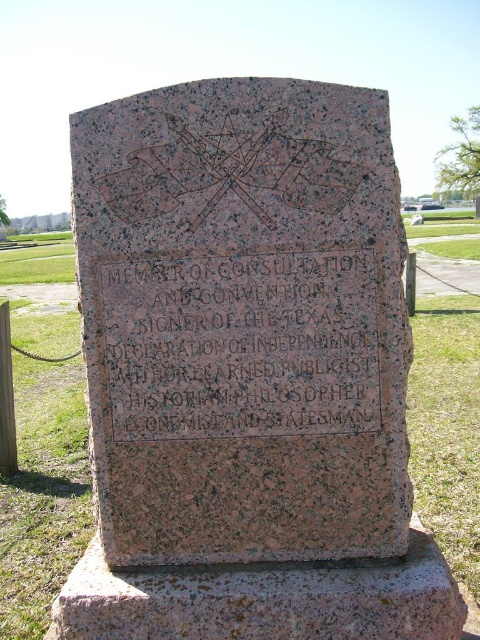
In the scene shown: Can you confirm if granite stone at center is bigger than black granite stone at center?

Yes.

Is granite stone at center shorter than black granite stone at center?

No.

Image resolution: width=480 pixels, height=640 pixels. What do you see at coordinates (242, 321) in the screenshot?
I see `granite stone at center` at bounding box center [242, 321].

Identify the location of granite stone at center. This screenshot has height=640, width=480. (242, 321).